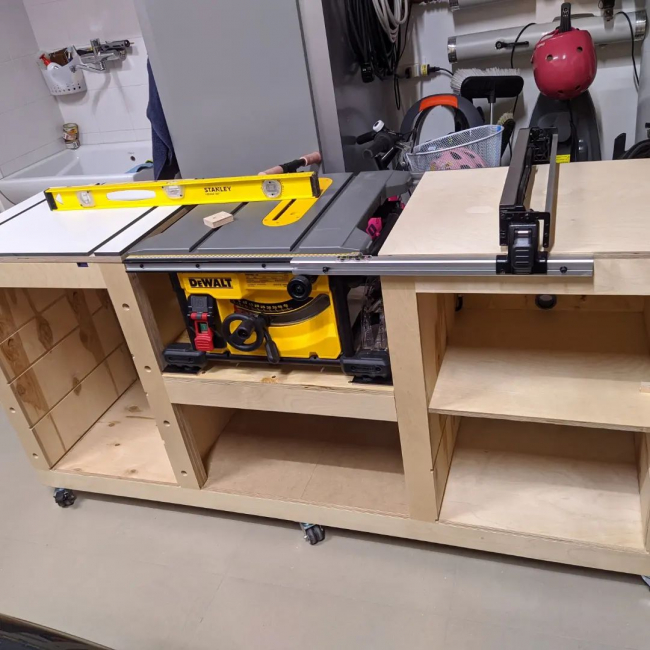
Where is `broom`? This screenshot has height=650, width=650. broom is located at coordinates (489, 82).